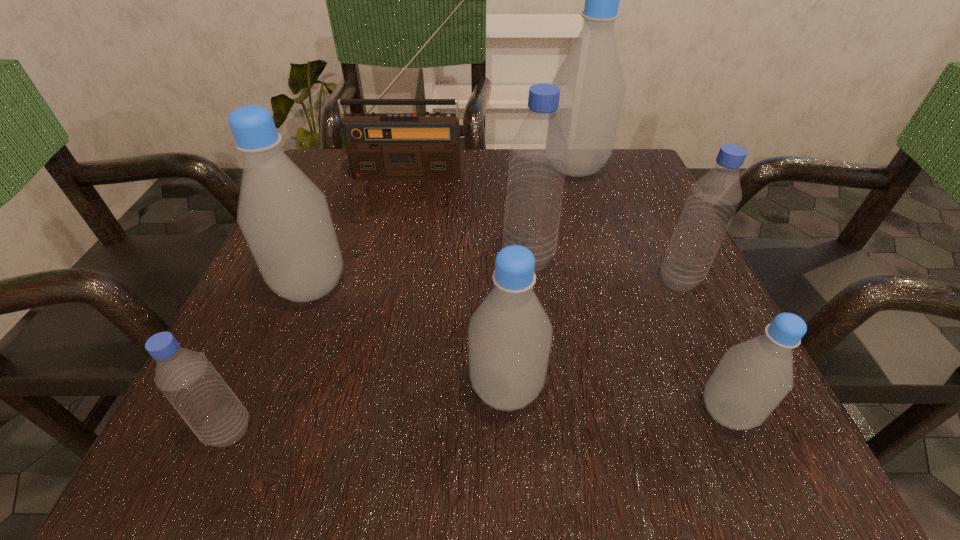
Identify the location of vacant area in the image that satisfies the following two spatial constraints: 1. on the front side of the rightmost blue bottle; 2. on the right side of the biggest blue bottle. This screenshot has height=540, width=960. (530, 280).